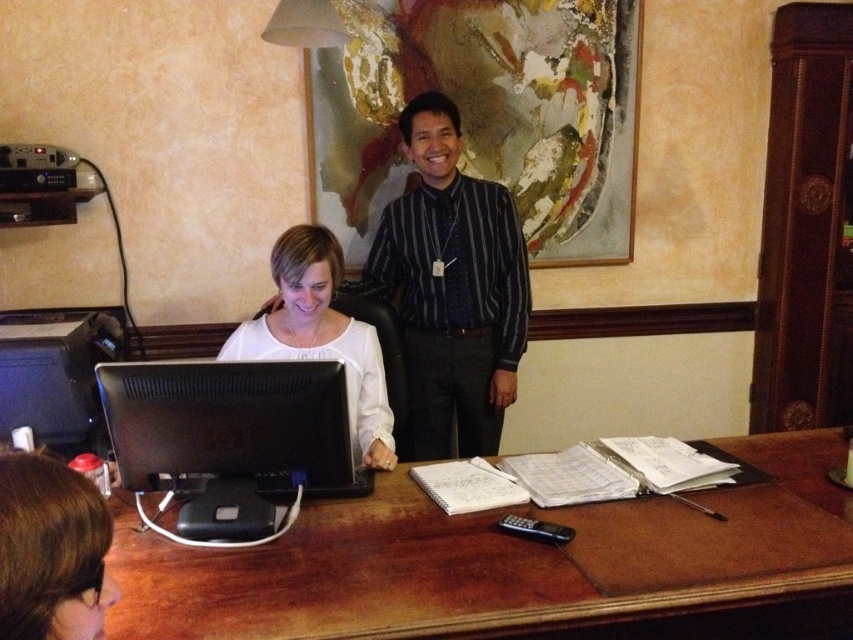
Question: Which of the following is the closest to the observer?

Choices:
 (A) (383, 468)
 (B) (393, 292)

Answer: (A)

Question: Can you confirm if brown wooden table at center is positioned above white matte shirt at center?

Choices:
 (A) no
 (B) yes

Answer: (A)

Question: Which is nearer to the striped shirt at center?

Choices:
 (A) white matte shirt at center
 (B) brown wooden table at center
 (C) black glossy monitor at center

Answer: (A)

Question: Which point is closer to the camera?

Choices:
 (A) (80, 632)
 (B) (224, 445)

Answer: (A)

Question: Is striped shirt at center thinner than white matte shirt at center?

Choices:
 (A) no
 (B) yes

Answer: (A)

Question: Does striped shirt at center appear over blonde hair at lower left?

Choices:
 (A) no
 (B) yes

Answer: (B)